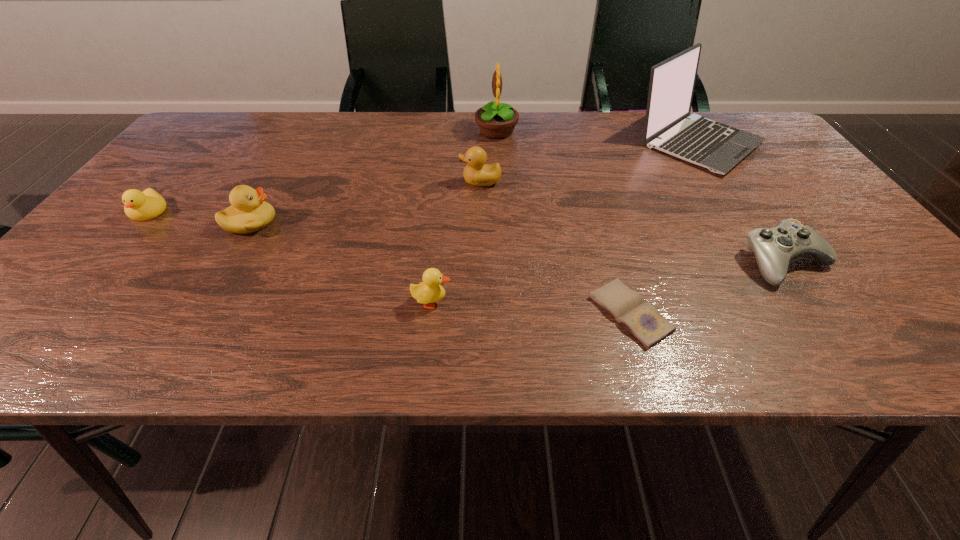
Image resolution: width=960 pixels, height=540 pixels. I want to click on the shortest object, so click(x=641, y=319).

Identify the location of vacant area located at the front screen of the laptop_computer. This screenshot has width=960, height=540. (774, 254).

Identify the location of free space located on the face of the sunflower. (417, 131).

At what (x,y) coordinates should I click in order to perform the action: click on vacant area located on the face of the sunflower. Please return your answer as a coordinate pair (x, y). The width and height of the screenshot is (960, 540). Looking at the image, I should click on (438, 131).

Where is `vacant region located 0.280m on the face of the sunflower`? This screenshot has height=540, width=960. vacant region located 0.280m on the face of the sunflower is located at coordinates (379, 131).

At what (x,y) coordinates should I click in order to perform the action: click on vacant space located 0.340m facing forward on the rightmost duckling. Please return your answer as a coordinate pair (x, y). The width and height of the screenshot is (960, 540). Looking at the image, I should click on (324, 181).

Locate an element on the screen. This screenshot has width=960, height=540. vacant region located facing forward on the rightmost duckling is located at coordinates (304, 181).

The width and height of the screenshot is (960, 540). What are the coordinates of `free space located 0.120m facing forward on the rightmost duckling` in the screenshot? It's located at coord(412,181).

Where is `free space located 0.160m on the front-facing side of the second object from left to right`? The height and width of the screenshot is (540, 960). free space located 0.160m on the front-facing side of the second object from left to right is located at coordinates (346, 222).

Locate an element on the screen. The height and width of the screenshot is (540, 960). vacant position located on the front-facing side of the third duckling from left to right is located at coordinates pos(633,302).